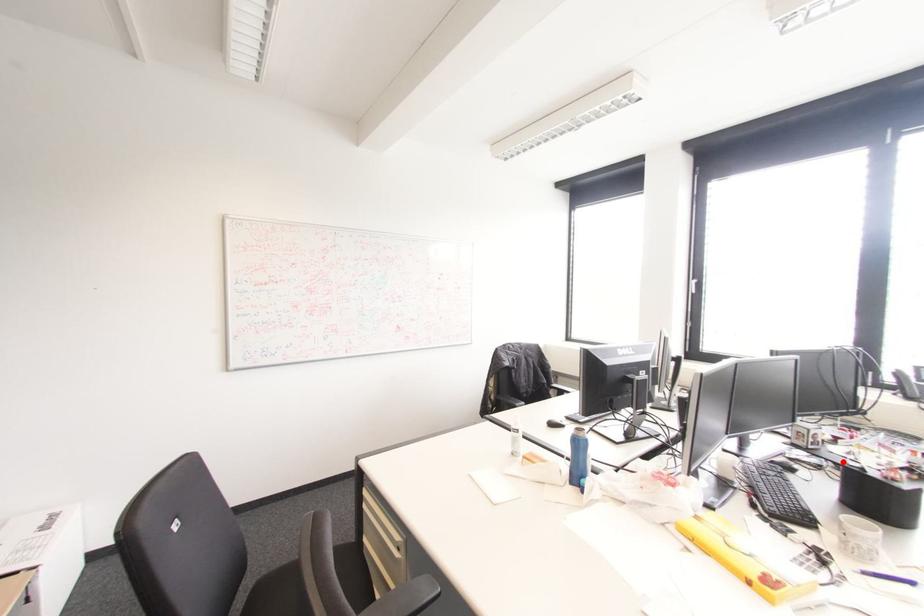
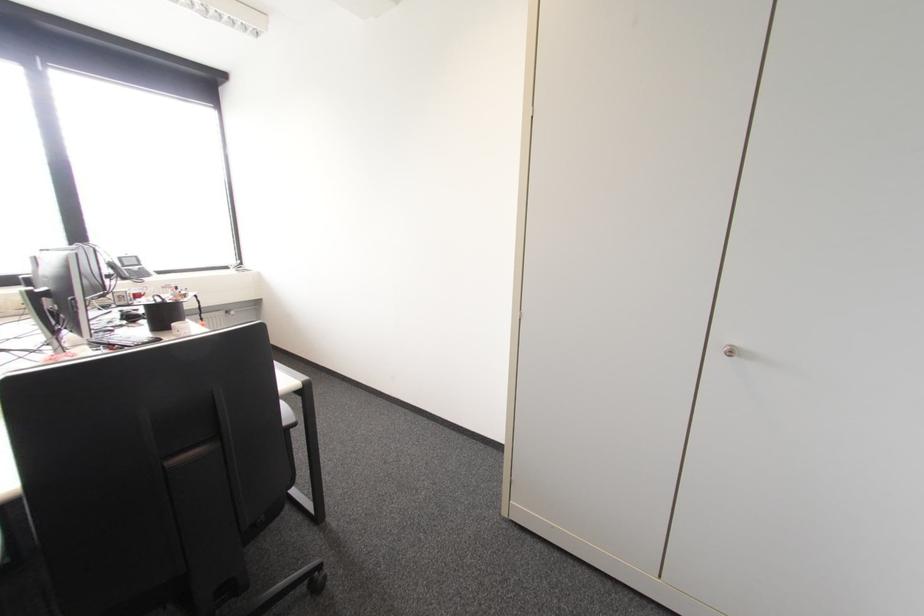
Question: I am providing you with two images of the same scene from different viewpoints. Given a red point in image1, look at the same physical point in image2. Is it:

Choices:
 (A) Closer to the viewpoint
 (B) Farther from the viewpoint

Answer: (B)